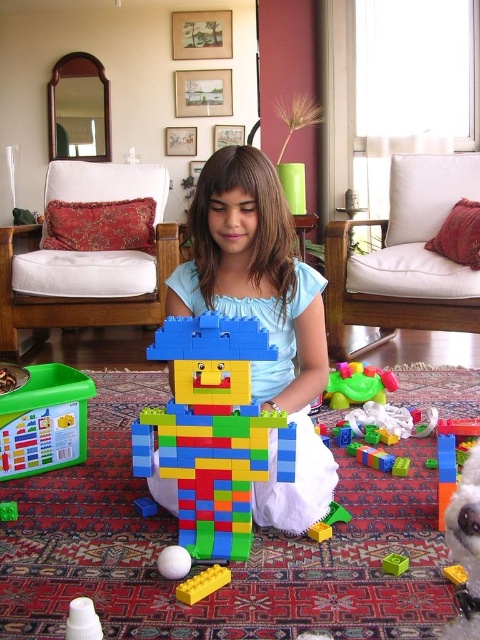
You are a parent trying to decide whether to let your child play with the white fluffy dog at lower right and the smooth plastic toy at center. Considering the height difference between them, which toy is safer for a child under 3 years old to play with and why?

The smooth plastic toy at center is safer for a child under 3 years old because the white fluffy dog at lower right is much taller, which could pose a choking hazard or be harder for small hands to handle safely.

You are a parent helping your child with LEGO construction. You see the multicolored plastic toy at center and the green plastic block at center. Which object is taller?

The multicolored plastic toy at center is much taller than the green plastic block at center.